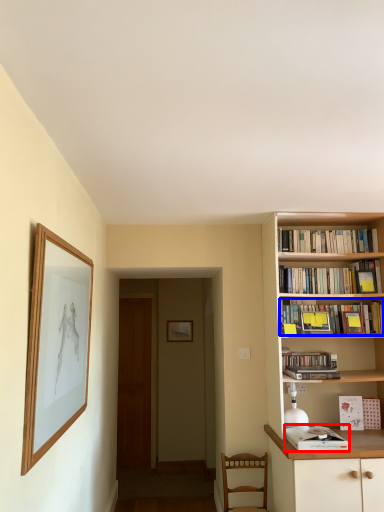
Question: Among these objects, which one is nearest to the camera, book (highlighted by a red box) or book (highlighted by a blue box)?

Choices:
 (A) book
 (B) book

Answer: (A)